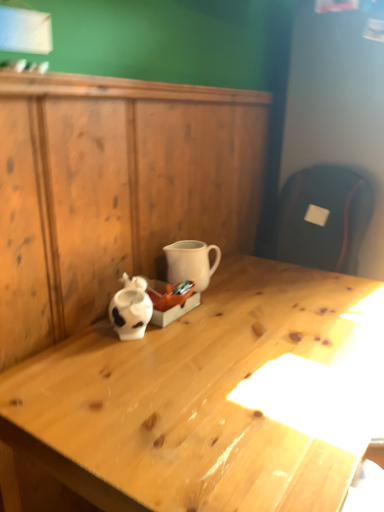
Question: Considering the relative positions of light wood desk at center and white matte coffee cup at center in the image provided, is light wood desk at center to the left or to the right of white matte coffee cup at center?

Choices:
 (A) right
 (B) left

Answer: (A)

Question: Is point (201, 457) closer or farther from the camera than point (175, 247)?

Choices:
 (A) farther
 (B) closer

Answer: (B)

Question: Which of these objects is positioned closest to the light wood desk at center?

Choices:
 (A) white matte coffee cup at center
 (B) wooden dresser at center

Answer: (A)

Question: Estimate the real-world distances between objects in this image. Which object is farther from the wooden dresser at center?

Choices:
 (A) white matte coffee cup at center
 (B) light wood desk at center

Answer: (B)